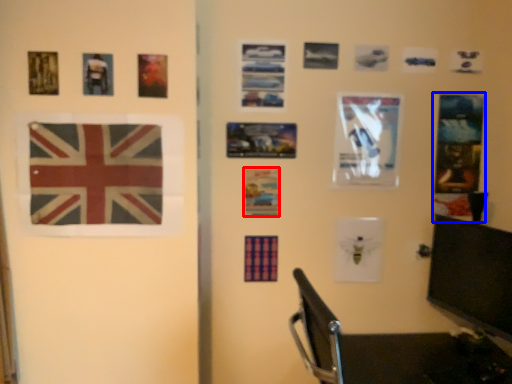
Question: Which object appears farthest to the camera in this image, postcard (highlighted by a red box) or postcard (highlighted by a blue box)?

Choices:
 (A) postcard
 (B) postcard

Answer: (B)